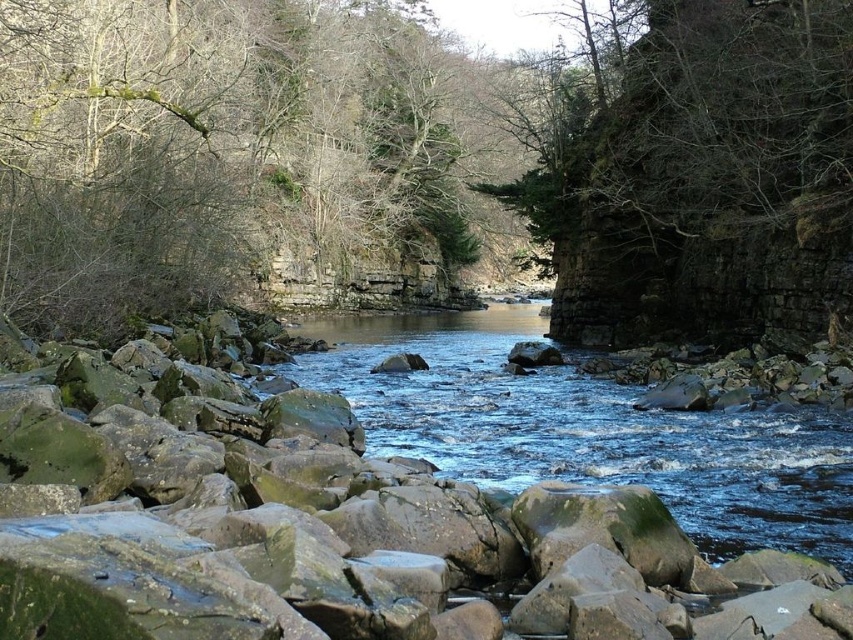
Question: Among these objects, which one is nearest to the camera?

Choices:
 (A) green mossy tree at center
 (B) clear water at center

Answer: (B)

Question: Is green mossy tree at center to the right of clear water at center from the viewer's perspective?

Choices:
 (A) yes
 (B) no

Answer: (B)

Question: Is green mossy tree at center smaller than clear water at center?

Choices:
 (A) yes
 (B) no

Answer: (B)

Question: Which of the following is the farthest from the observer?

Choices:
 (A) clear water at center
 (B) green mossy tree at center

Answer: (B)

Question: Which point is farther to the camera?

Choices:
 (A) (537, 417)
 (B) (354, 29)

Answer: (B)

Question: Can you confirm if green mossy tree at center is bigger than clear water at center?

Choices:
 (A) no
 (B) yes

Answer: (B)